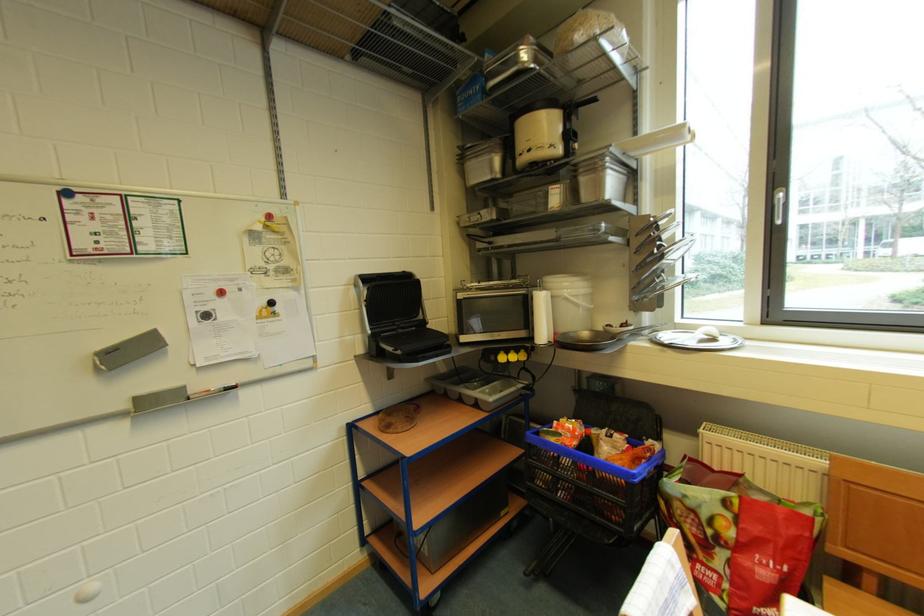
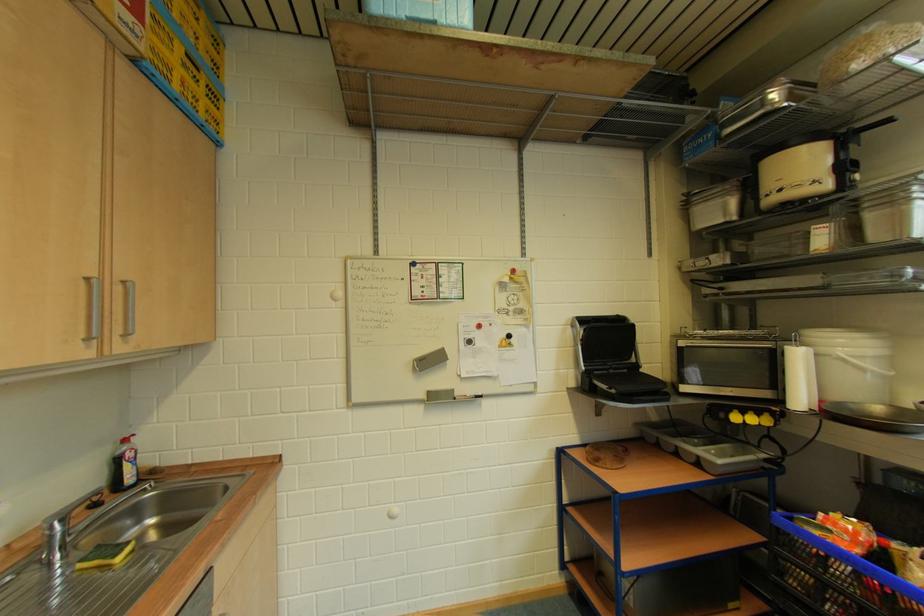
Find the pixel in the second image that matches point (578, 299) in the first image.

(858, 360)